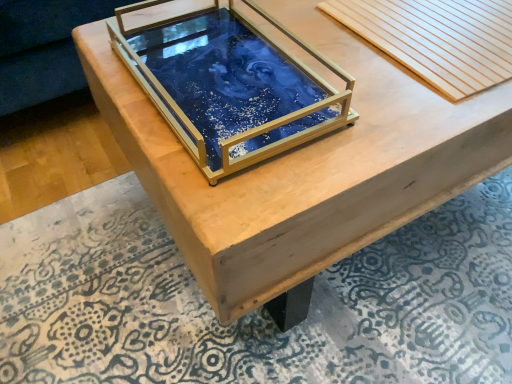
This screenshot has height=384, width=512. Identify the location of free spot below blue resin tray at center (from a real-world perspective). (x=218, y=75).